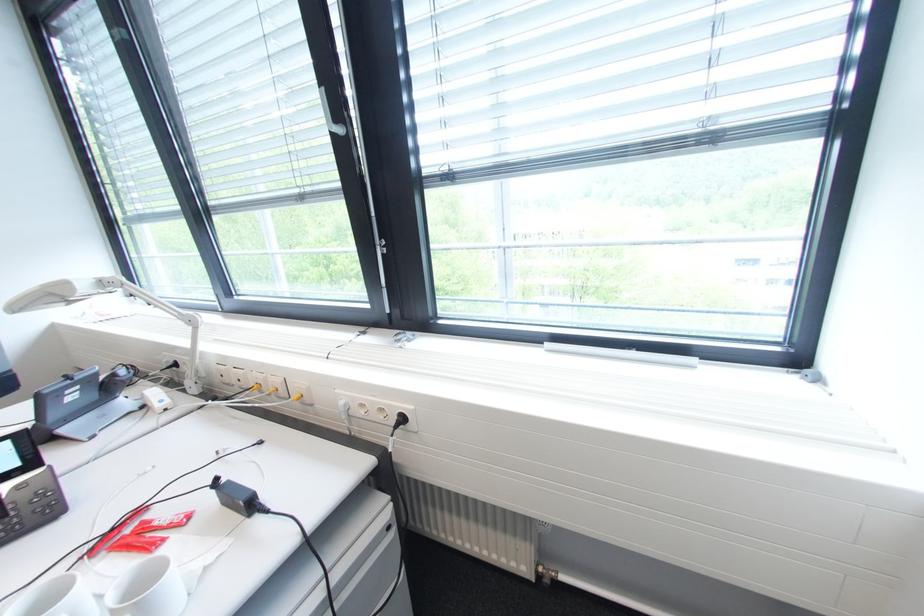
The height and width of the screenshot is (616, 924). Identify the location of white window handle. (330, 115).